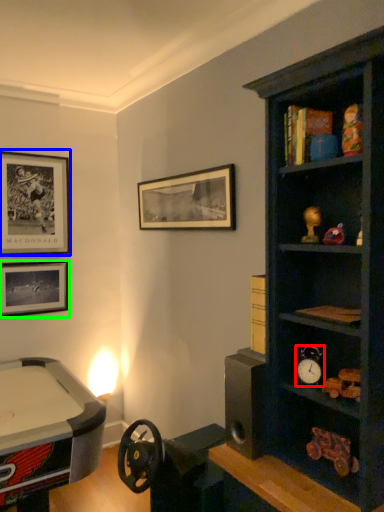
Question: Considering the real-world distances, which object is closest to clock (highlighted by a red box)? picture frame (highlighted by a blue box) or picture frame (highlighted by a green box).

Choices:
 (A) picture frame
 (B) picture frame

Answer: (B)